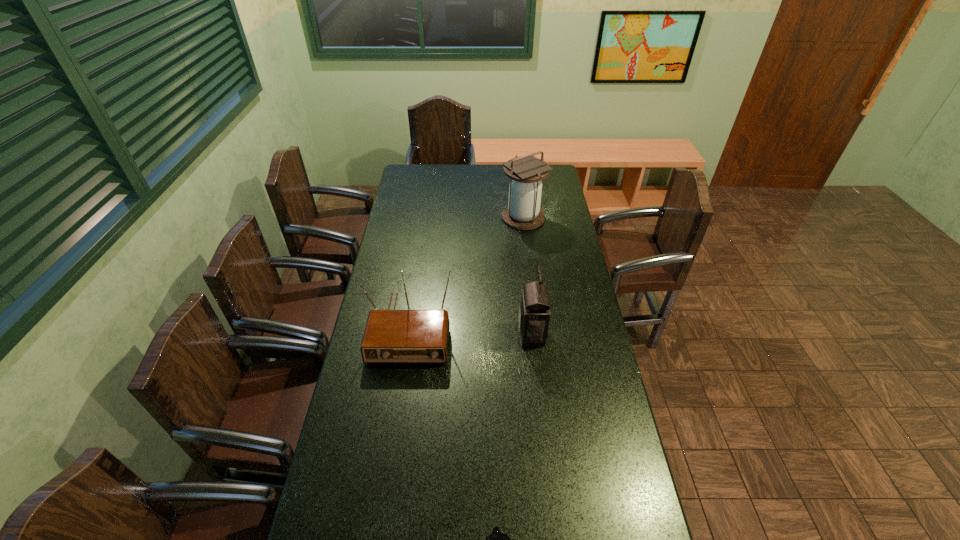
Locate an element on the screen. the third closest object relative to the second farthest lantern is located at coordinates (496, 539).

Identify the location of the second closest lantern relative to the leftmost object. (526, 173).

Identify which lantern is the second nearest to the farthest object. Please provide its 2D coordinates. Your answer should be formatted as a tuple, i.e. [(x, y)], where the tuple contains the x and y coordinates of a point satisfying the conditions above.

[(496, 539)]